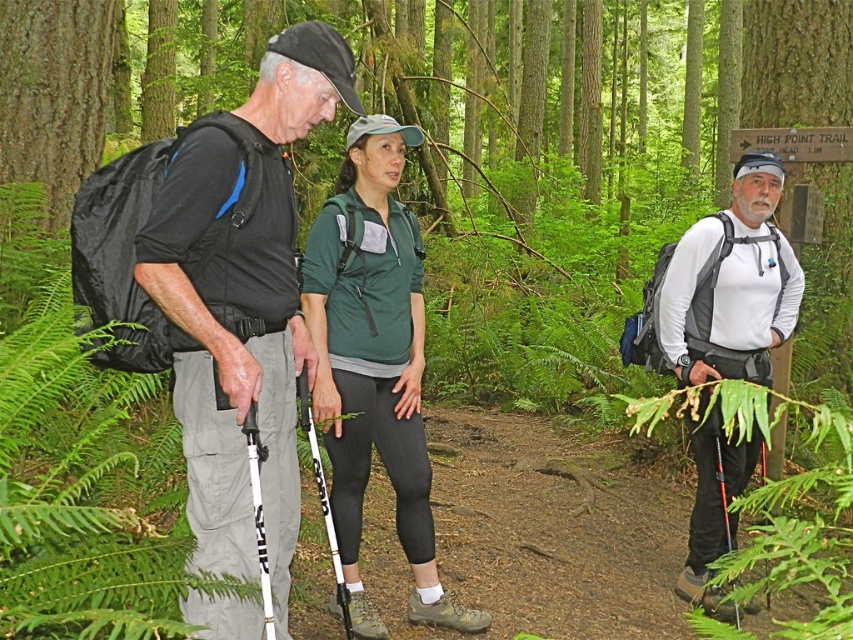
Question: Considering the real-world distances, which object is farthest from the green leafy fern at left?

Choices:
 (A) black matte backpack at left
 (B) green fabric shirt at center

Answer: (B)

Question: Does black matte backpack at left appear over white matte shirt at center?

Choices:
 (A) yes
 (B) no

Answer: (A)

Question: Which point is farther to the camera?

Choices:
 (A) white matte shirt at center
 (B) green fabric shirt at center

Answer: (A)

Question: Among these objects, which one is nearest to the camera?

Choices:
 (A) green fabric shirt at center
 (B) green leafy fern at left
 (C) black matte backpack at left

Answer: (B)

Question: Does black matte backpack at left appear on the left side of green leafy fern at left?

Choices:
 (A) yes
 (B) no

Answer: (B)

Question: Considering the relative positions of green leafy fern at left and green fabric shirt at center in the image provided, where is green leafy fern at left located with respect to green fabric shirt at center?

Choices:
 (A) above
 (B) below

Answer: (B)